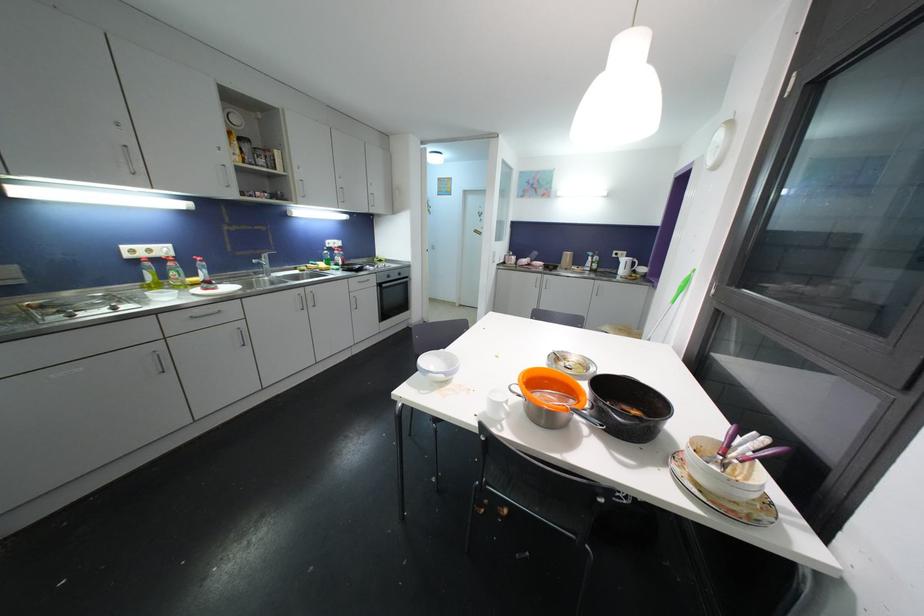
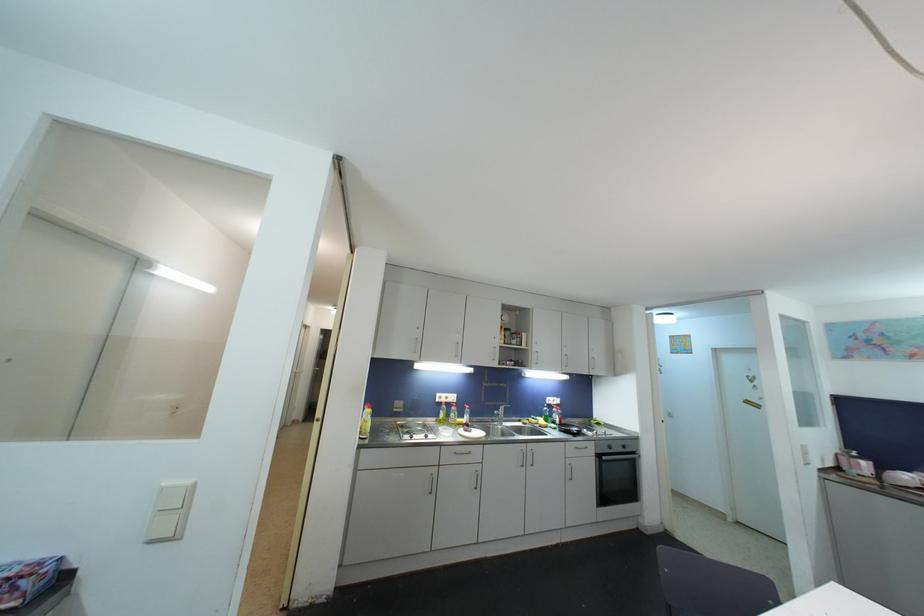
The point at (390, 276) is marked in the first image. Where is the corresponding point in the second image?

(611, 446)